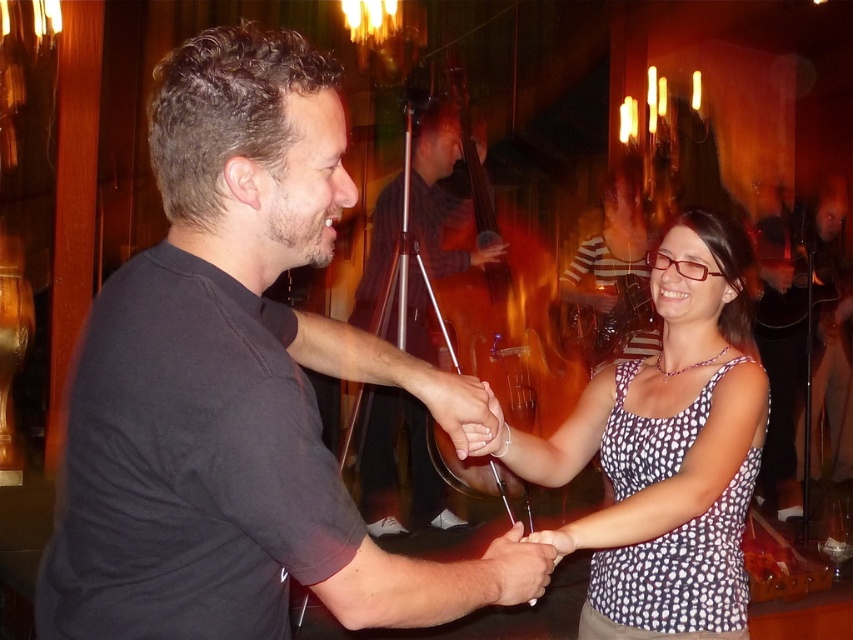
You are a photographer at the event and want to capture a closeup of the smooth skin at center and the matte black hand at center. Which object should you zoom in on to ensure it fills the frame without cropping?

The smooth skin at center has a larger size compared to the matte black hand at center, so you should zoom in on the smooth skin at center to ensure it fills the frame without cropping.

You are a photographer at the party and want to focus on the white dotted tank top at center and the smooth skin at center. Which object should you adjust your camera to focus on first if you want to capture both in a single shot?

You should focus on the white dotted tank top at center first because it is closer to the viewer than the smooth skin at center, allowing for better depth of field when capturing both in one shot.